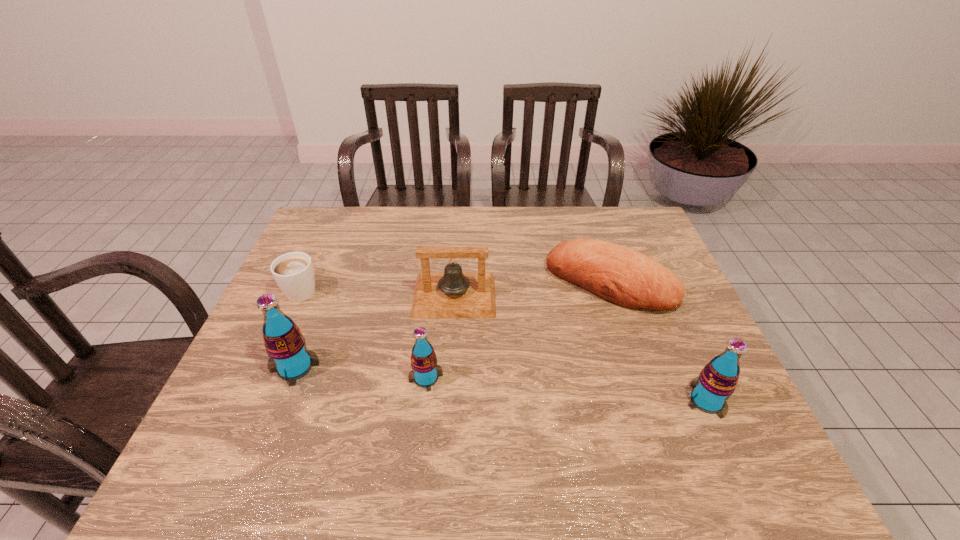
Locate an element on the screen. Image resolution: width=960 pixels, height=540 pixels. vacant region that satisfies the following two spatial constraints: 1. on the back side of the second soda from left to right; 2. on the right side of the bread is located at coordinates (437, 283).